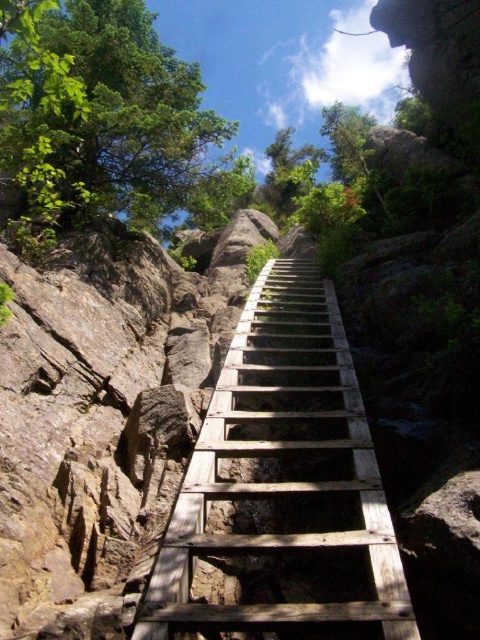
Question: Is weathered wood ladder at center closer to the viewer compared to green leafy tree at upper left?

Choices:
 (A) yes
 (B) no

Answer: (A)

Question: Is weathered wood ladder at center thinner than green leafy tree at upper left?

Choices:
 (A) no
 (B) yes

Answer: (B)

Question: Observing the image, what is the correct spatial positioning of weathered wood ladder at center in reference to green leafy tree at upper left?

Choices:
 (A) above
 (B) below

Answer: (B)